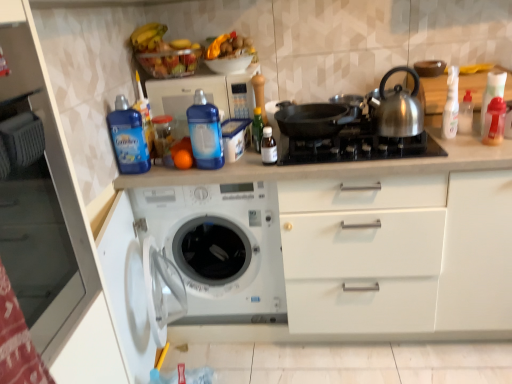
Question: Is transparent plastic spray bottle at right, which ranks as the 2th bottle in right-to-left order, positioned with its back to yellow matte bananas at upper center?

Choices:
 (A) yes
 (B) no

Answer: (B)

Question: From the image's perspective, would you say transparent plastic spray bottle at right, which is the seventh bottle in left-to-right order, is positioned over yellow matte bananas at upper center?

Choices:
 (A) no
 (B) yes

Answer: (A)

Question: Can you confirm if transparent plastic spray bottle at right, which ranks as the 2th bottle in right-to-left order, is shorter than yellow matte bananas at upper center?

Choices:
 (A) yes
 (B) no

Answer: (B)

Question: Is transparent plastic spray bottle at right, which ranks as the 2th bottle in right-to-left order, to the right of yellow matte bananas at upper center from the viewer's perspective?

Choices:
 (A) yes
 (B) no

Answer: (A)

Question: Considering the relative sizes of transparent plastic spray bottle at right, which is the seventh bottle in left-to-right order, and yellow matte bananas at upper center in the image provided, is transparent plastic spray bottle at right, which is the seventh bottle in left-to-right order, taller than yellow matte bananas at upper center?

Choices:
 (A) yes
 (B) no

Answer: (A)

Question: Is transparent plastic spray bottle at right, which ranks as the 2th bottle in right-to-left order, wider than yellow matte bananas at upper center?

Choices:
 (A) no
 (B) yes

Answer: (A)

Question: From the image's perspective, is white plastic washing machine at lower left over white plastic spray bottle at upper right, arranged as the 3th bottle when viewed from the right?

Choices:
 (A) no
 (B) yes

Answer: (A)

Question: Does white plastic washing machine at lower left have a smaller size compared to white plastic spray bottle at upper right, arranged as the 3th bottle when viewed from the right?

Choices:
 (A) yes
 (B) no

Answer: (B)

Question: Is white plastic washing machine at lower left next to white plastic spray bottle at upper right, arranged as the 3th bottle when viewed from the right, and touching it?

Choices:
 (A) no
 (B) yes

Answer: (A)

Question: Can you confirm if white plastic washing machine at lower left is positioned to the left of white plastic spray bottle at upper right, arranged as the 3th bottle when viewed from the right?

Choices:
 (A) no
 (B) yes

Answer: (B)

Question: Is white plastic washing machine at lower left to the right of white plastic spray bottle at upper right, placed as the 6th bottle when sorted from left to right, from the viewer's perspective?

Choices:
 (A) yes
 (B) no

Answer: (B)

Question: From the image's perspective, would you say white plastic washing machine at lower left is shown under white plastic spray bottle at upper right, placed as the 6th bottle when sorted from left to right?

Choices:
 (A) no
 (B) yes

Answer: (B)

Question: Would you consider blue plastic microwave at upper center to be distant from black matte pan at center?

Choices:
 (A) yes
 (B) no

Answer: (B)